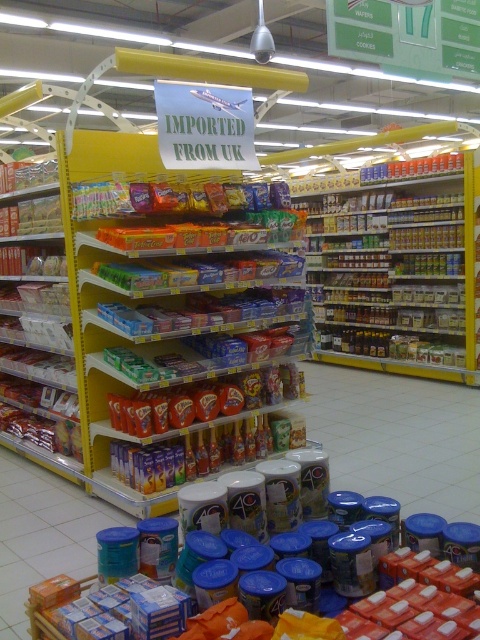
Question: Does shiny plastic candy at center have a lesser width compared to blue plastic canister at lower center?

Choices:
 (A) yes
 (B) no

Answer: (B)

Question: Does matte plastic snack at left come in front of blue plastic canister at lower center?

Choices:
 (A) no
 (B) yes

Answer: (A)

Question: Which point appears farthest from the camera in this image?

Choices:
 (A) (48, 440)
 (B) (468, 600)

Answer: (A)

Question: Does shiny plastic candy at center have a greater width compared to blue plastic canister at lower center?

Choices:
 (A) yes
 (B) no

Answer: (A)

Question: Which point is farther from the camera taking this photo?

Choices:
 (A) (243, 292)
 (B) (35, 589)

Answer: (A)

Question: Among these objects, which one is farthest from the camera?

Choices:
 (A) blue plastic canister at lower center
 (B) metallic silver spice jars at center

Answer: (B)